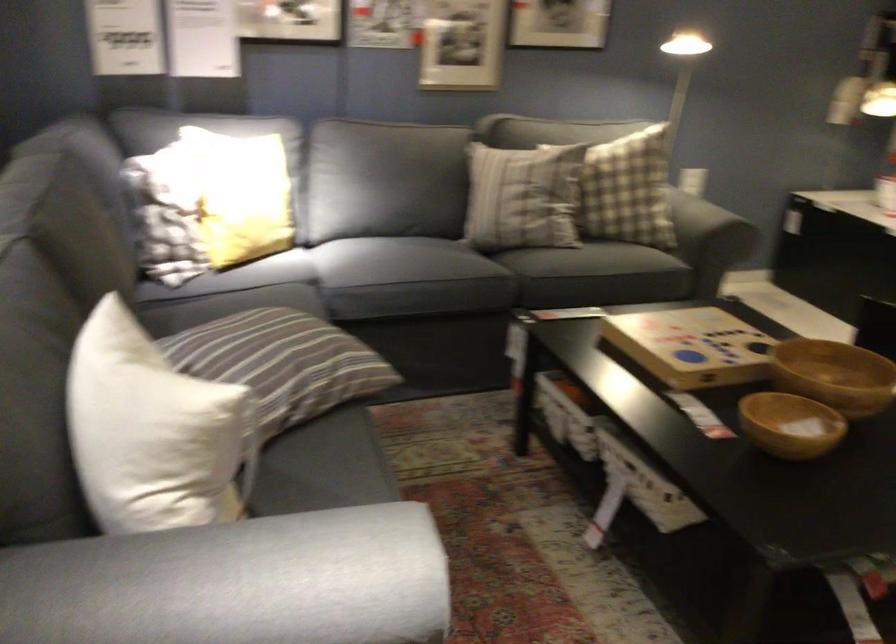
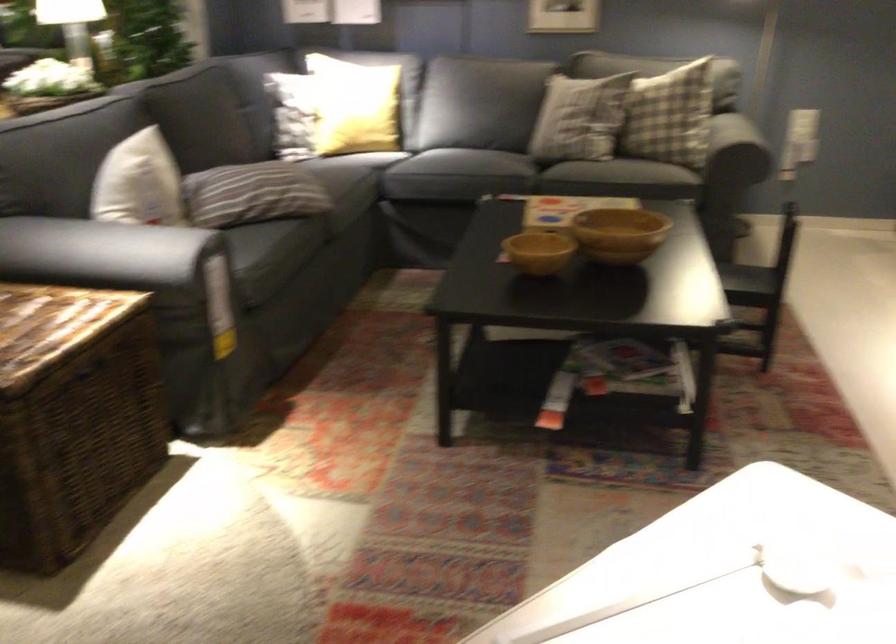
The images are taken continuously from a first-person perspective. In which direction are you moving?

The cameraman moved toward right, backward.